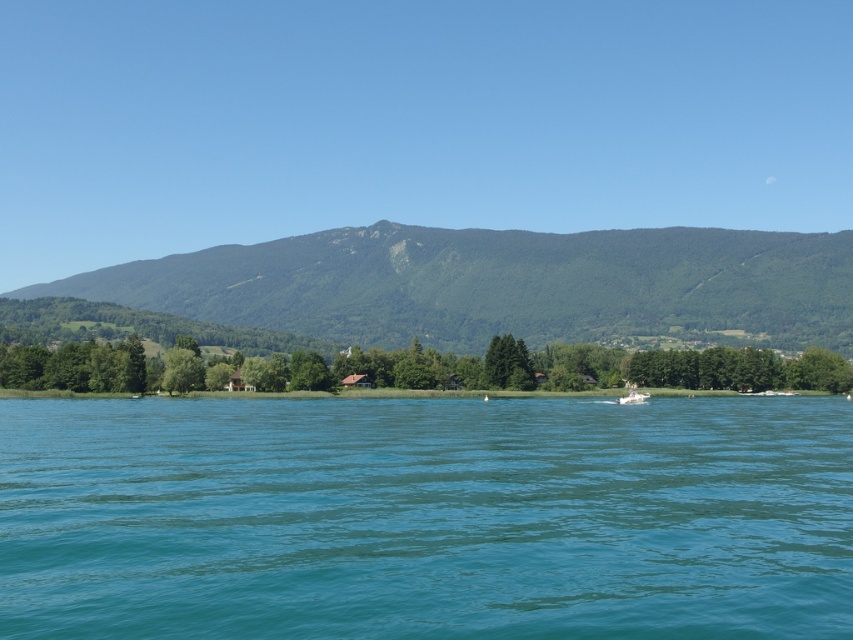
The image size is (853, 640). Identify the location of green textured mountain at upper center. (502, 285).

Which of these two, green textured mountain at upper center or green leafy trees at center, stands taller?

Standing taller between the two is green textured mountain at upper center.

The width and height of the screenshot is (853, 640). What are the coordinates of `green textured mountain at upper center` in the screenshot? It's located at (502, 285).

Can you confirm if green textured mountain at upper center is taller than white plastic boat at center?

Yes, green textured mountain at upper center is taller than white plastic boat at center.

Is point (53, 288) positioned before point (643, 394)?

That is False.

Between point (265, 310) and point (616, 401), which one is positioned behind?

Positioned behind is point (265, 310).

This screenshot has width=853, height=640. What are the coordinates of `green textured mountain at upper center` in the screenshot? It's located at (502, 285).

Who is higher up, green leafy trees at center or white plastic boat at center?

green leafy trees at center

Can you confirm if green leafy trees at center is wider than white plastic boat at center?

Yes, green leafy trees at center is wider than white plastic boat at center.

Find the location of a particular element. green leafy trees at center is located at coordinates (561, 369).